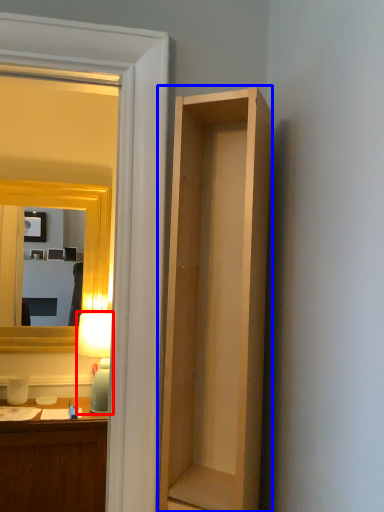
Question: Which of the following is the closest to the observer, lamp (highlighted by a red box) or cabinetry (highlighted by a blue box)?

Choices:
 (A) lamp
 (B) cabinetry

Answer: (B)